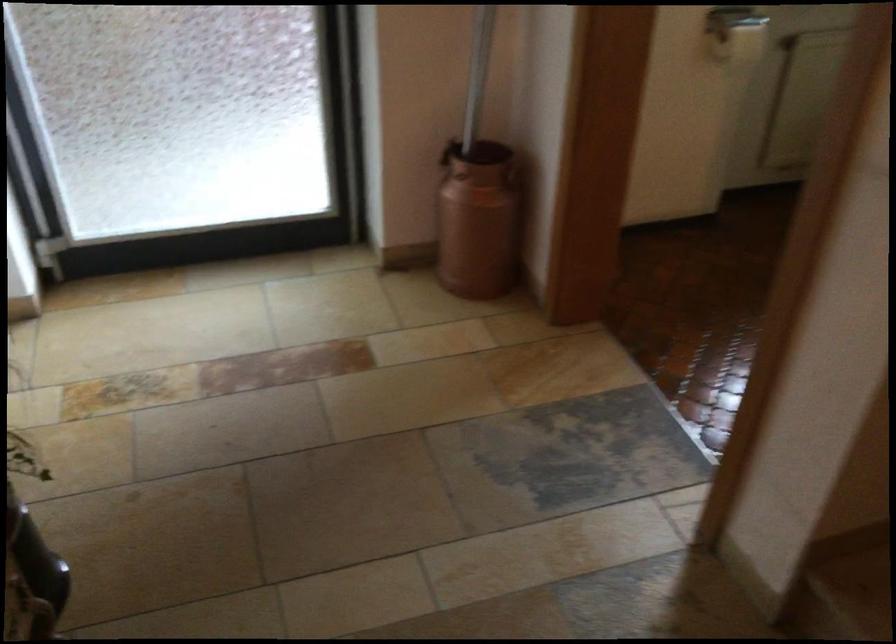
What do you see at coordinates (513, 176) in the screenshot? I see `a milk can handle` at bounding box center [513, 176].